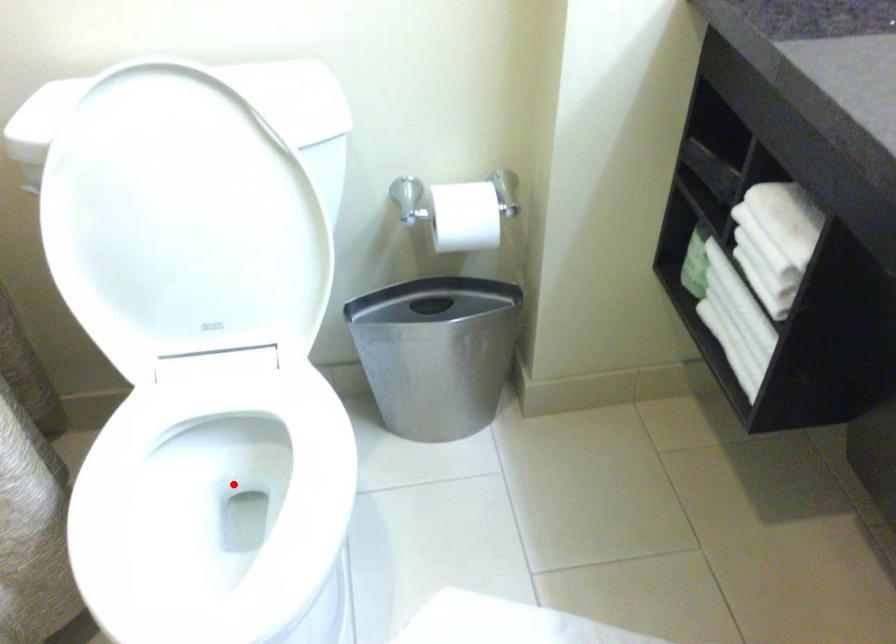
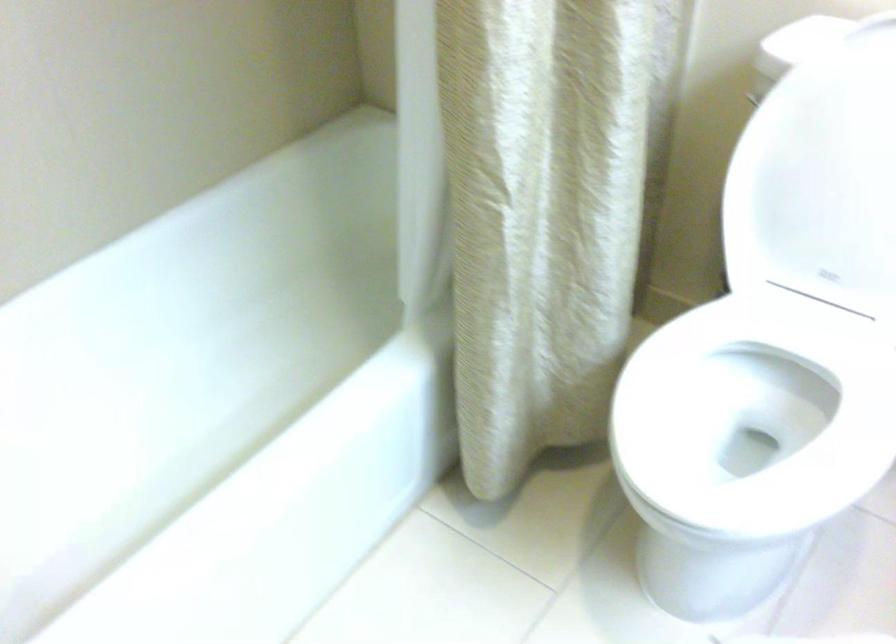
The point at the highlighted location is marked in the first image. Where is the corresponding point in the second image?

(752, 420)